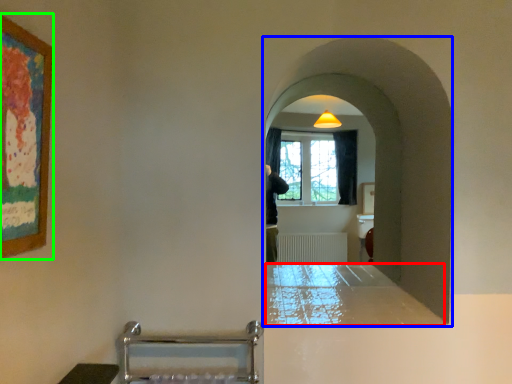
Question: Considering the real-world distances, which object is closest to counter top (highlighted by a red box)? passage (highlighted by a blue box) or picture frame (highlighted by a green box).

Choices:
 (A) passage
 (B) picture frame

Answer: (A)